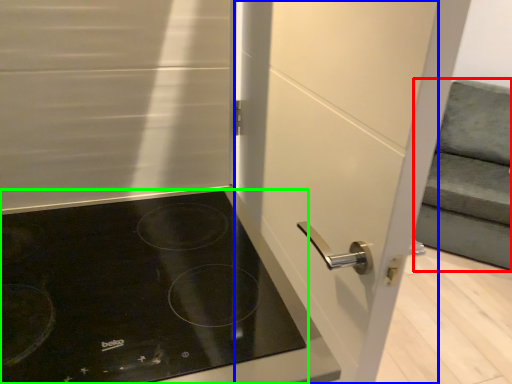
Question: Which object is positioned farthest from armchair (highlighted by a red box)? Select from screen door (highlighted by a blue box) and gas stove (highlighted by a green box).

Choices:
 (A) screen door
 (B) gas stove

Answer: (B)